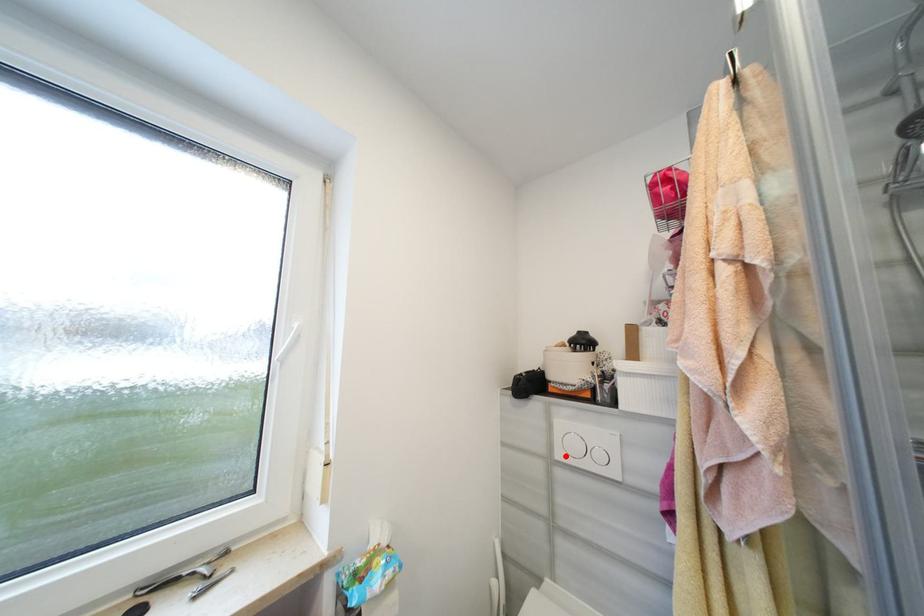
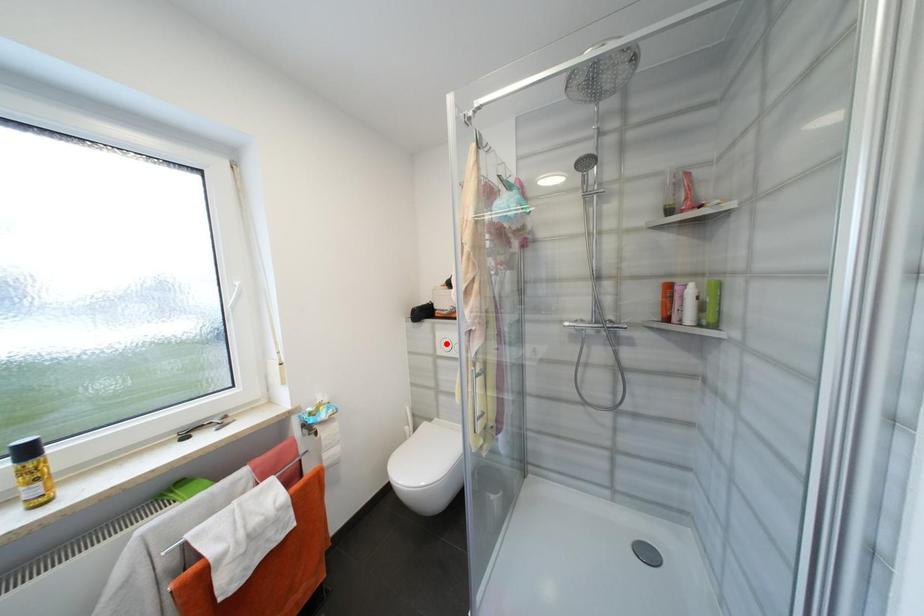
I am providing you with two images of the same scene from different viewpoints. A red point is marked on the first image and another point is marked on the second image. Are the points marked in image1 and image2 representing the same 3D position?

No